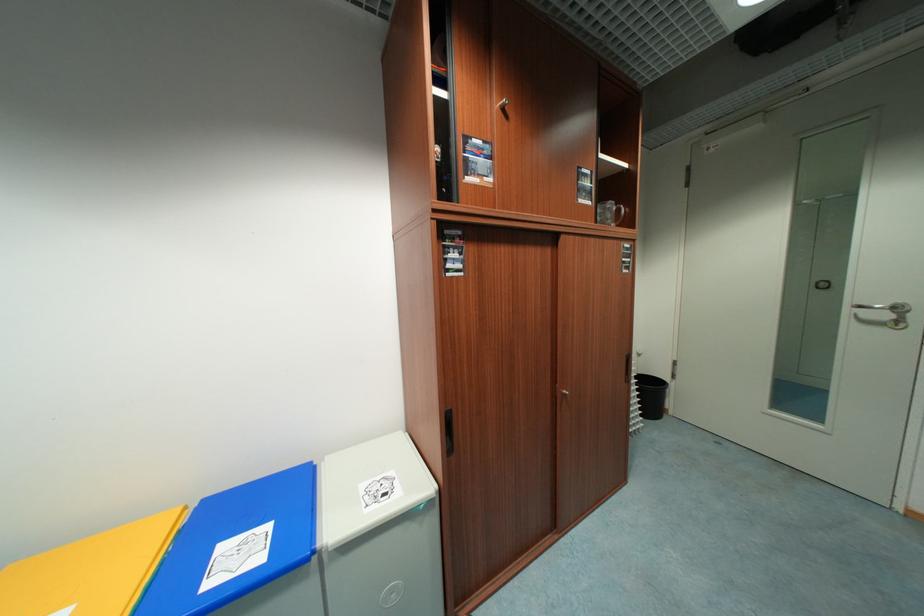
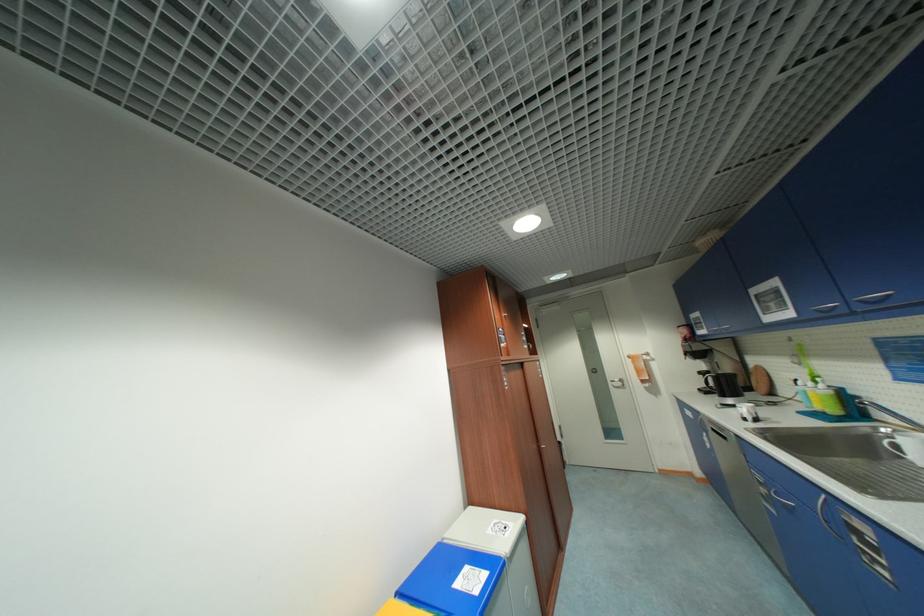
The point at (853, 312) is marked in the first image. Where is the corresponding point in the second image?

(615, 384)